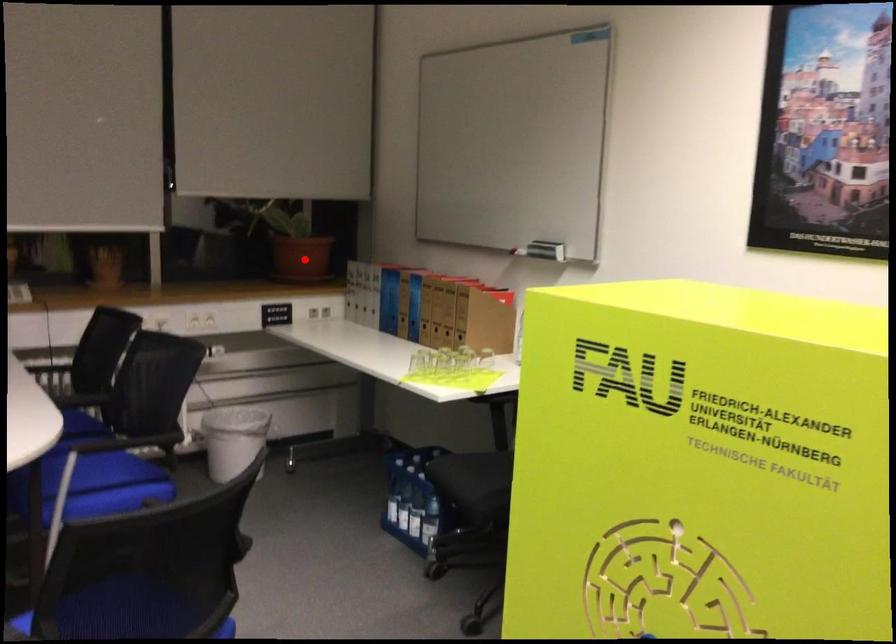
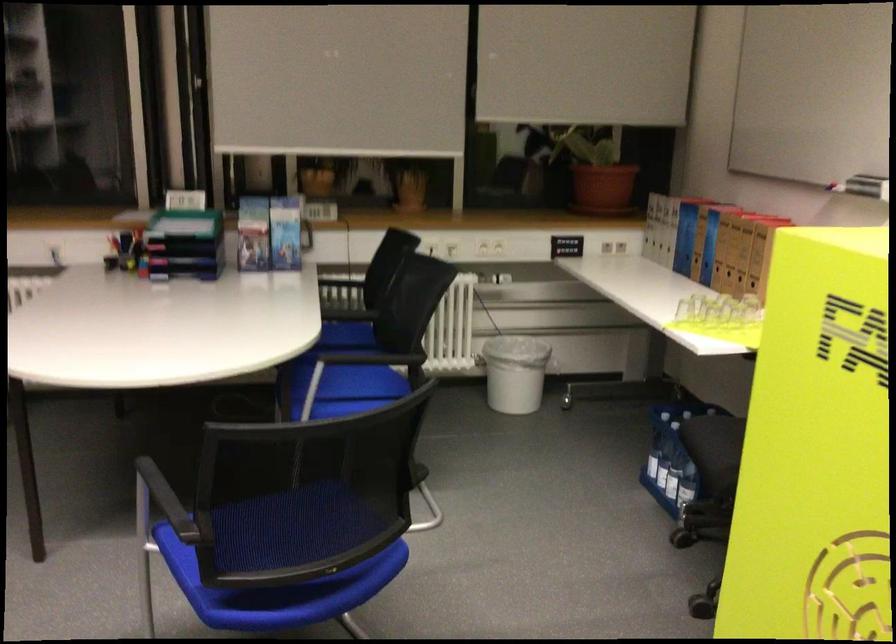
Locate, in the second image, the point that corresponds to the highlighted location in the first image.

(602, 187)